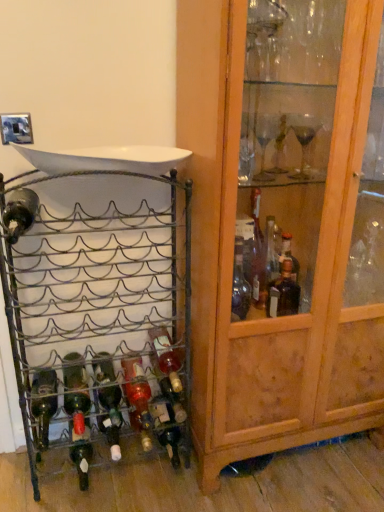
Where is `unoccupied space behind translucent glass bottle at lower left, positioned as the third bottle in left-to-right order`? unoccupied space behind translucent glass bottle at lower left, positioned as the third bottle in left-to-right order is located at coordinates (106, 445).